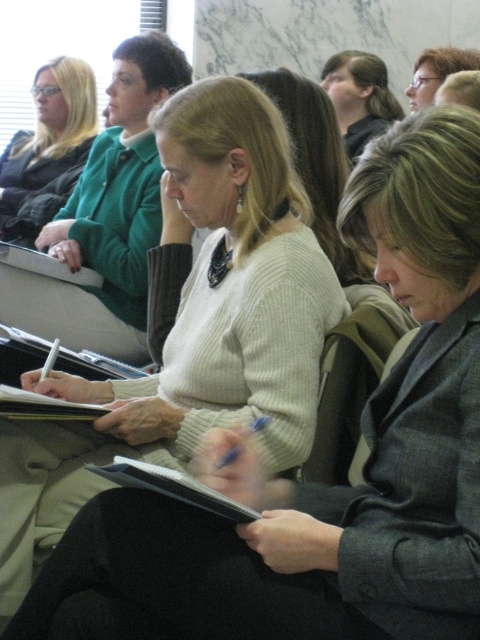
You are a photographer trying to capture a clear shot of the matte black hair at upper center and the black matte notebook at center. Based on their heights, which object should you focus on first to ensure both are in focus?

The matte black hair at upper center is taller than the black matte notebook at center, so focusing on the taller object first would ensure both are in focus.

You are organizing a photo shoot and need to place a small decorative item between the matte green sweater at upper left and the matte black glasses at upper center. Which object should the item be placed closer to if you want it to be equidistant from both?

The item should be placed closer to the matte black glasses at upper center because the matte green sweater at upper left is bigger, so the center of the sweater is farther away from the glasses than the edge of the sweater. To maintain equal distance, the item must be closer to the smaller object.

You are an event planner arranging seating for a presentation. You need to place a name tag for the person wearing the matte green sweater at upper left and another for the person wearing the matte black glasses at upper center. Based on their positions in the image, which name tag should be placed higher on the seating chart?

The matte black glasses at upper center should be placed higher on the seating chart because the matte green sweater at upper left is positioned under it, indicating a higher position in the image.